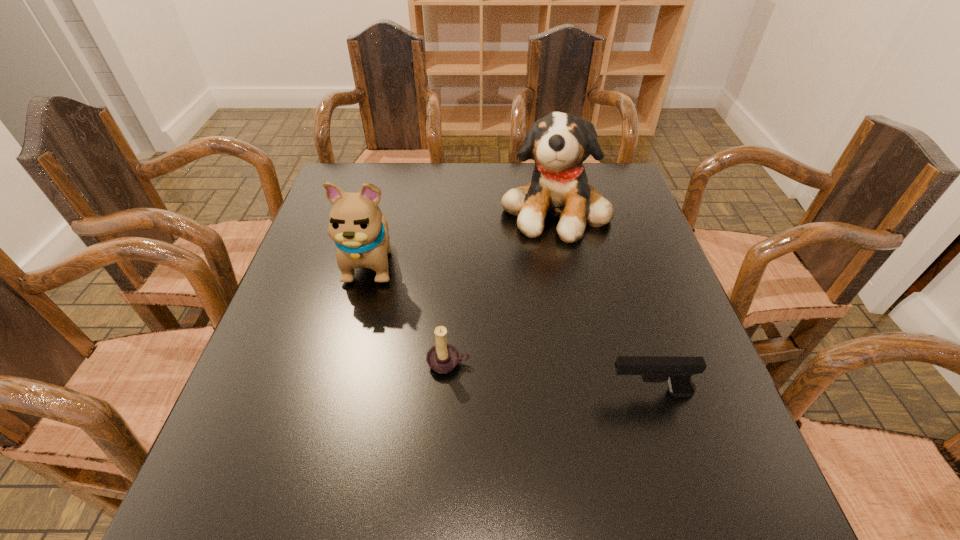
Where is `vacant space located on the front-facing side of the pistol`? vacant space located on the front-facing side of the pistol is located at coordinates (461, 393).

Image resolution: width=960 pixels, height=540 pixels. I want to click on object situated at the far edge, so click(559, 143).

The height and width of the screenshot is (540, 960). I want to click on object positioned at the left edge, so click(x=356, y=224).

This screenshot has width=960, height=540. What are the coordinates of `puppy that is at the right edge` in the screenshot? It's located at (559, 143).

The image size is (960, 540). What are the coordinates of `pistol present at the right edge` in the screenshot? It's located at (677, 371).

Locate an element on the screen. object that is at the far right corner is located at coordinates (559, 143).

Where is `vacant space at the far edge of the desktop`? The image size is (960, 540). vacant space at the far edge of the desktop is located at coordinates (516, 178).

Identify the location of vacant space at the near edge. (565, 475).

This screenshot has height=540, width=960. In order to click on vacant region at the left edge in this screenshot , I will do `click(311, 233)`.

At what (x,y) coordinates should I click in order to perform the action: click on vacant space at the right edge. Please return your answer as a coordinate pair (x, y). This screenshot has height=540, width=960. Looking at the image, I should click on (610, 264).